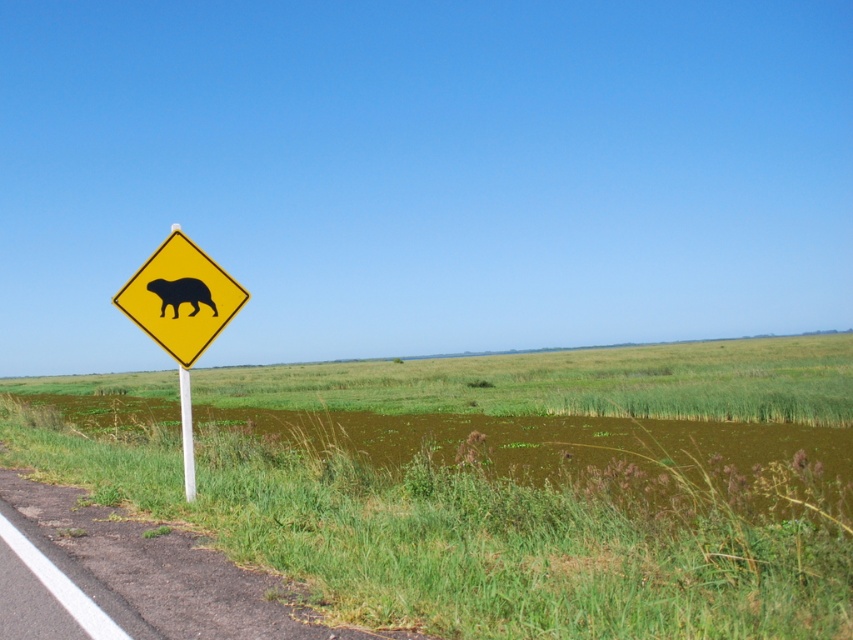
You are standing at the yellow road sign on the left side of the road and want to walk to the point marked at coordinates point (177, 289) and then to point (183, 413). Which point will you reach first?

You will reach point (177, 289) first because it is closer to you than point (183, 413), which is further away.

You are driving on the road and see the yellow plastic diamond at left and the black matte bear at left. Which object is taller?

The yellow plastic diamond at left is much taller than the black matte bear at left.